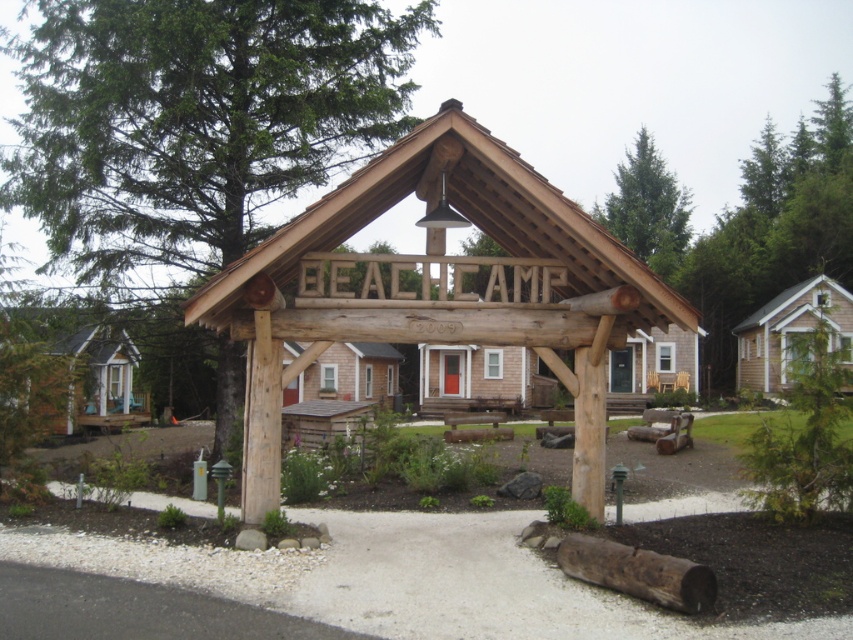
Question: From the image, what is the correct spatial relationship of green textured tree at upper left in relation to green coniferous tree at upper right?

Choices:
 (A) right
 (B) left

Answer: (B)

Question: Considering the relative positions of natural wood sign at center and wooden cabin at right in the image provided, where is natural wood sign at center located with respect to wooden cabin at right?

Choices:
 (A) above
 (B) below

Answer: (A)

Question: Which of the following is the farthest from the observer?

Choices:
 (A) (114, 356)
 (B) (361, 198)
 (C) (633, 192)

Answer: (C)

Question: Can you confirm if wooden cabin at left is thinner than wooden cabin at right?

Choices:
 (A) no
 (B) yes

Answer: (B)

Question: Which of the following is the farthest from the observer?

Choices:
 (A) (662, 253)
 (B) (433, 118)
 (C) (274, 173)
 (D) (331, 348)

Answer: (A)

Question: Which object is positioned closest to the wooden cabin at left?

Choices:
 (A) wooden cabin at center
 (B) green coniferous tree at upper right
 (C) wooden cabin at right
 (D) natural wood sign at center

Answer: (A)